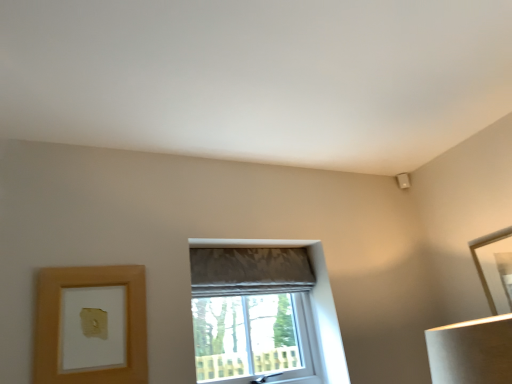
Question: Considering the relative sizes of matte gray fabric window at center and matte gray curtain at center in the image provided, is matte gray fabric window at center thinner than matte gray curtain at center?

Choices:
 (A) no
 (B) yes

Answer: (A)

Question: Considering the relative sizes of matte gray fabric window at center and matte gray curtain at center in the image provided, is matte gray fabric window at center wider than matte gray curtain at center?

Choices:
 (A) yes
 (B) no

Answer: (A)

Question: Does matte gray fabric window at center come behind matte gray curtain at center?

Choices:
 (A) no
 (B) yes

Answer: (A)

Question: Considering the relative sizes of matte gray fabric window at center and matte gray curtain at center in the image provided, is matte gray fabric window at center smaller than matte gray curtain at center?

Choices:
 (A) no
 (B) yes

Answer: (A)

Question: Is matte gray fabric window at center beside matte gray curtain at center?

Choices:
 (A) no
 (B) yes

Answer: (A)

Question: Is matte gray curtain at center situated inside matte gray fabric window at center or outside?

Choices:
 (A) inside
 (B) outside

Answer: (A)

Question: Considering the positions of point (245, 256) and point (339, 349), is point (245, 256) closer or farther from the camera than point (339, 349)?

Choices:
 (A) farther
 (B) closer

Answer: (A)

Question: From the image's perspective, is matte gray curtain at center positioned above or below matte gray fabric window at center?

Choices:
 (A) above
 (B) below

Answer: (A)

Question: From their relative heights in the image, would you say matte gray curtain at center is taller or shorter than matte gray fabric window at center?

Choices:
 (A) tall
 (B) short

Answer: (B)

Question: Is wooden picture frame at lower left, the second picture frame positioned from the right, wider or thinner than gold metallic picture frame at upper right, which is the 2th picture frame from front to back?

Choices:
 (A) wide
 (B) thin

Answer: (B)

Question: Visually, is wooden picture frame at lower left, the second picture frame positioned from the right, positioned to the left or to the right of gold metallic picture frame at upper right, which is the 2th picture frame from front to back?

Choices:
 (A) left
 (B) right

Answer: (A)

Question: Is wooden picture frame at lower left, positioned as the 1th picture frame in left-to-right order, in front of or behind gold metallic picture frame at upper right, placed as the 1th picture frame when sorted from back to front, in the image?

Choices:
 (A) behind
 (B) front

Answer: (B)

Question: From the image's perspective, is wooden picture frame at lower left, the second picture frame positioned from the right, above or below gold metallic picture frame at upper right, the second picture frame viewed from the left?

Choices:
 (A) above
 (B) below

Answer: (B)

Question: From the image's perspective, is matte gray fabric window at center above or below gold metallic picture frame at upper right, placed as the 1th picture frame when sorted from back to front?

Choices:
 (A) below
 (B) above

Answer: (A)

Question: Relative to gold metallic picture frame at upper right, placed as the 1th picture frame when sorted from back to front, is matte gray fabric window at center in front or behind?

Choices:
 (A) front
 (B) behind

Answer: (A)